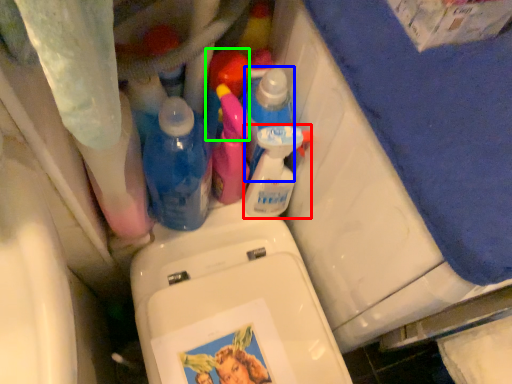
Question: Which object is positioned farthest from cleaning product (highlighted by a red box)? Select from cleaning product (highlighted by a blue box) and cleaning product (highlighted by a green box).

Choices:
 (A) cleaning product
 (B) cleaning product

Answer: (B)